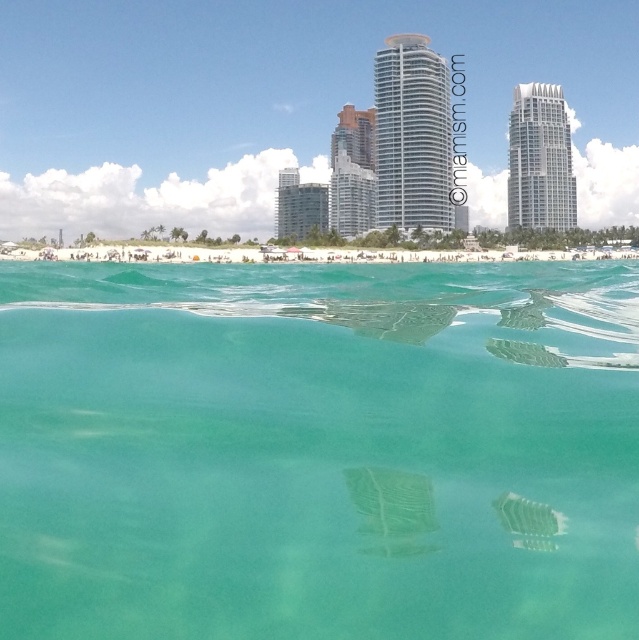
Who is lower down, smooth glass skyscraper at center or smooth glass building at center?

Positioned lower is smooth glass building at center.

Where is `smooth glass skyscraper at center`? smooth glass skyscraper at center is located at coordinates (351, 172).

Is clear glass water at center thinner than clear glass skyscraper at center?

No, clear glass water at center is not thinner than clear glass skyscraper at center.

Who is positioned more to the left, clear glass water at center or clear glass skyscraper at center?

clear glass water at center is more to the left.

Between point (275, 380) and point (392, 170), which one is positioned in front?

Point (275, 380) is in front.

Image resolution: width=639 pixels, height=640 pixels. Find the location of `clear glass water at center`. clear glass water at center is located at coordinates (318, 451).

Does clear glass water at center appear under smooth glass building at center?

Indeed, clear glass water at center is positioned under smooth glass building at center.

Does clear glass water at center appear over smooth glass building at center?

Actually, clear glass water at center is below smooth glass building at center.

Locate an element on the screen. This screenshot has height=640, width=639. clear glass water at center is located at coordinates (318, 451).

Where is `clear glass water at center`? The height and width of the screenshot is (640, 639). clear glass water at center is located at coordinates (318, 451).